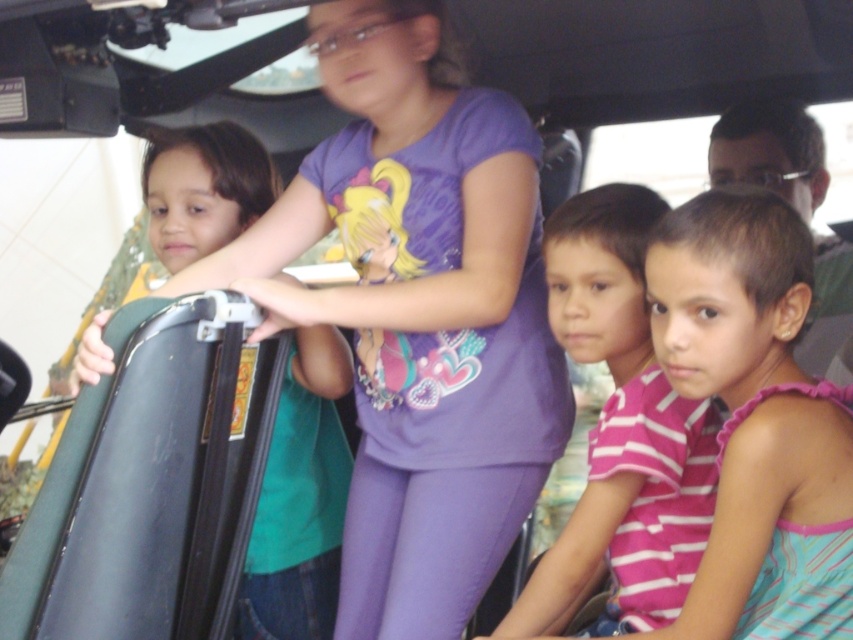
Can you confirm if pink striped shirt at lower left is shorter than pink striped shirt at center?

Yes, pink striped shirt at lower left is shorter than pink striped shirt at center.

Is pink striped shirt at lower left smaller than pink striped shirt at center?

Indeed, pink striped shirt at lower left has a smaller size compared to pink striped shirt at center.

Where is `pink striped shirt at lower left`? pink striped shirt at lower left is located at coordinates (755, 419).

Is pink striped shirt at lower left to the left of green matte suitcase at left from the viewer's perspective?

Answer: No, pink striped shirt at lower left is not to the left of green matte suitcase at left.

Does point (775, 499) come farther from viewer compared to point (252, 602)?

No.

Locate an element on the screen. This screenshot has width=853, height=640. pink striped shirt at lower left is located at coordinates (755, 419).

Between black matte suitcase at left and pink striped shirt at lower left, which one is positioned higher?

Positioned higher is pink striped shirt at lower left.

Which of these two, black matte suitcase at left or pink striped shirt at lower left, stands shorter?

black matte suitcase at left is shorter.

At what (x,y) coordinates should I click in order to perform the action: click on black matte suitcase at left. Please return your answer as a coordinate pair (x, y). Looking at the image, I should click on (152, 484).

This screenshot has width=853, height=640. In order to click on black matte suitcase at left in this screenshot , I will do `click(152, 484)`.